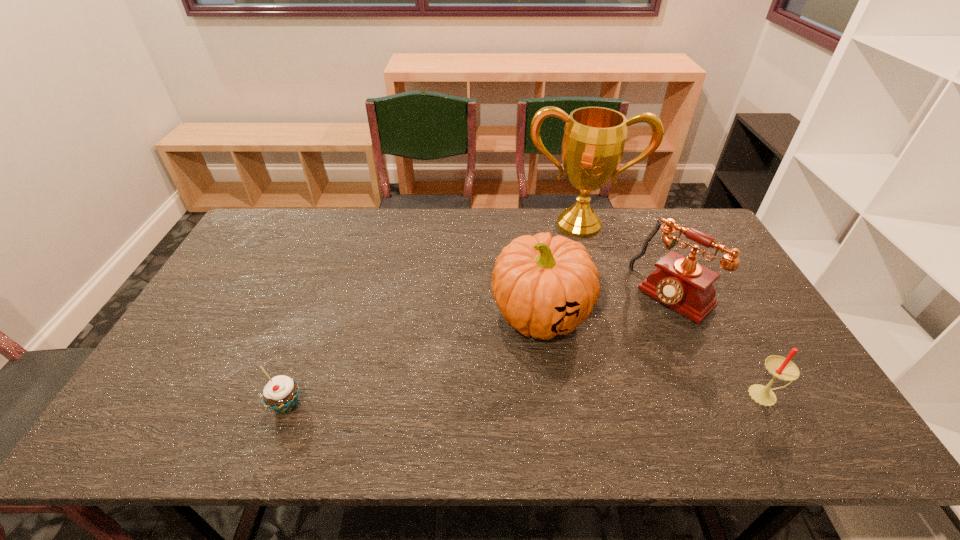
You are a GUI agent. You are given a task and a screenshot of the screen. Output one action in this format:
    pyautogui.click(x=<x>, y=<y>)
    Task: Click on the cupcake
    
    Given the screenshot: What is the action you would take?
    pyautogui.click(x=281, y=393)

Image resolution: width=960 pixels, height=540 pixels. In order to click on the leftmost object in this screenshot , I will do `click(281, 393)`.

What are the coordinates of `the fourth tallest object` in the screenshot? It's located at (780, 367).

I want to click on telephone, so click(x=679, y=282).

This screenshot has width=960, height=540. Find the location of `pumpkin`. pumpkin is located at coordinates (543, 286).

Find the location of `award`. award is located at coordinates (594, 138).

Find the location of a particular element. This screenshot has width=960, height=540. the tallest object is located at coordinates (594, 138).

Identify the location of free region located on the left of the shortest object. Image resolution: width=960 pixels, height=540 pixels. (209, 405).

Where is `vacant space located 0.220m on the back of the fourth tallest object`? vacant space located 0.220m on the back of the fourth tallest object is located at coordinates (723, 317).

At what (x,y) coordinates should I click in order to perform the action: click on vacant space located on the dial of the telephone. Please return your answer as a coordinate pair (x, y). Looking at the image, I should click on (x=571, y=392).